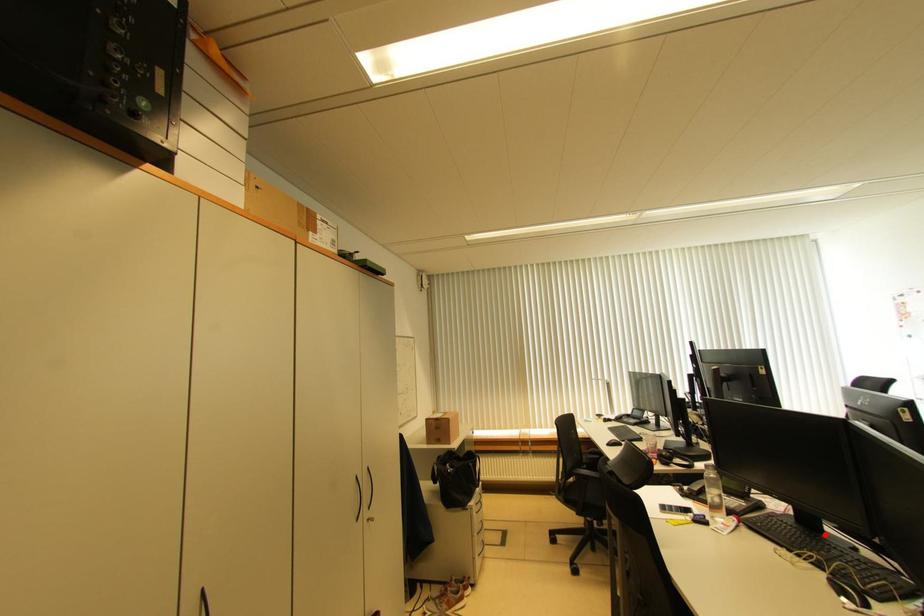
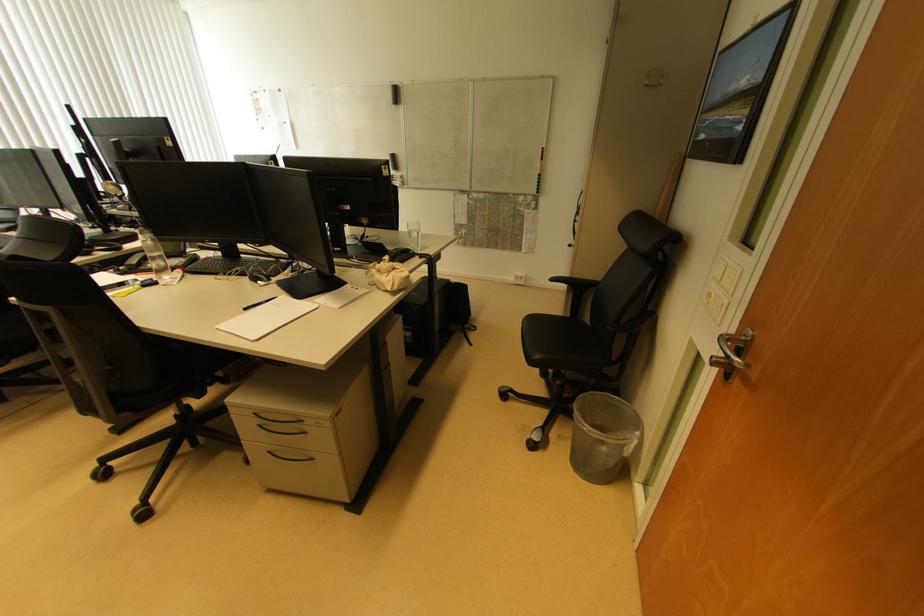
Locate, in the second image, the point that corresponds to the highlighted location in the first image.

(242, 261)